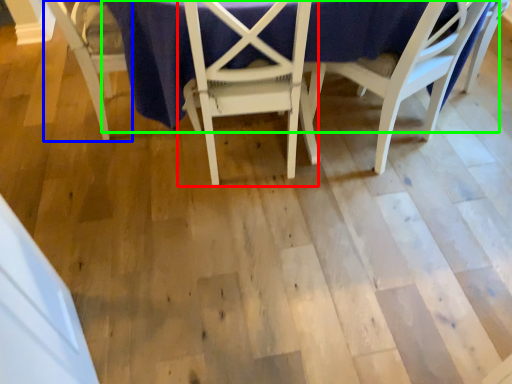
Question: Which is farther away from chair (highlighted by a red box)? chair (highlighted by a blue box) or table (highlighted by a green box)?

Choices:
 (A) chair
 (B) table

Answer: (A)